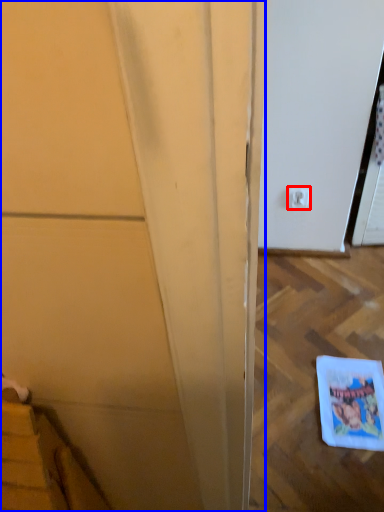
Question: Among these objects, which one is nearest to the camera, electric outlet (highlighted by a red box) or door (highlighted by a blue box)?

Choices:
 (A) electric outlet
 (B) door

Answer: (B)